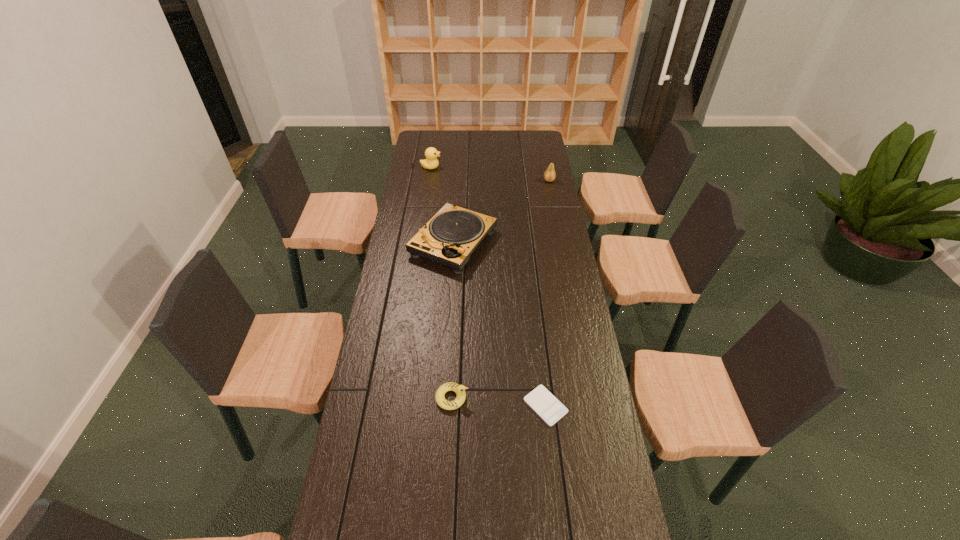
What are the coordinates of `empty space that is in between the rightmost object and the fourth tallest object` in the screenshot? It's located at (500, 289).

Find the location of a particular element. unoccupied position between the farthest object and the rightmost object is located at coordinates (491, 174).

Image resolution: width=960 pixels, height=540 pixels. Identify the location of vacant area that lies between the duckling and the shortest object. (499, 402).

This screenshot has height=540, width=960. Find the location of `free spot between the third farthest object and the fourth tallest object`. free spot between the third farthest object and the fourth tallest object is located at coordinates (453, 320).

This screenshot has height=540, width=960. Identify the location of vacant area that lies between the farthest object and the second shortest object. (442, 282).

You are a GUI agent. You are given a task and a screenshot of the screen. Output one action in this format:
    pyautogui.click(x=<x>, y=<y>)
    Task: Click on the free space between the third nearest object and the fourth nearest object
    This screenshot has height=540, width=960.
    Given the screenshot: What is the action you would take?
    pyautogui.click(x=501, y=212)

This screenshot has height=540, width=960. Find the location of `free space between the pear and the farthest object`. free space between the pear and the farthest object is located at coordinates (491, 174).

The height and width of the screenshot is (540, 960). I want to click on free point between the record player and the rightmost object, so (x=501, y=212).

The image size is (960, 540). In order to click on vacant area that lies between the duck and the pear in this screenshot , I will do `click(491, 174)`.

Identify which object is the second closest to the pear. Please provide its 2D coordinates. Your answer should be formatted as a tuple, i.e. [(x, y)], where the tuple contains the x and y coordinates of a point satisfying the conditions above.

[(431, 154)]